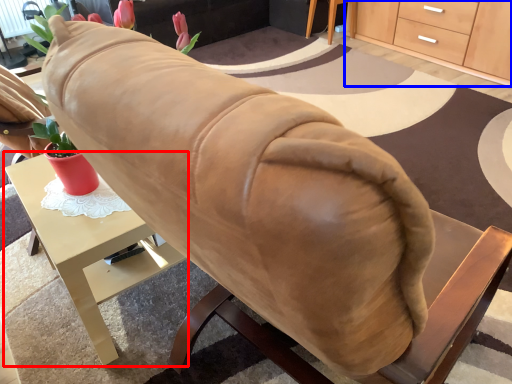
Question: Which object is closer to the camera taking this photo, desk (highlighted by a red box) or cabinetry (highlighted by a blue box)?

Choices:
 (A) desk
 (B) cabinetry

Answer: (A)